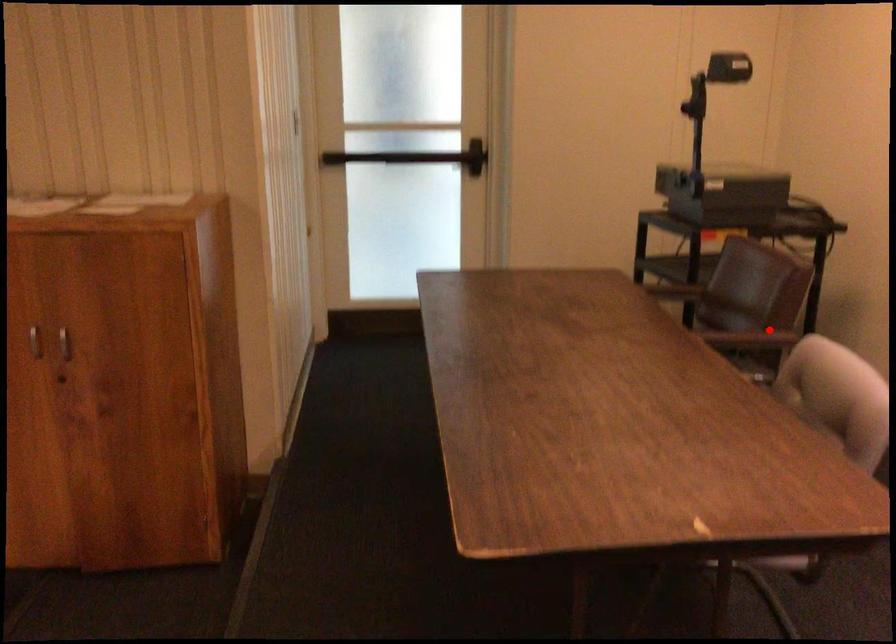
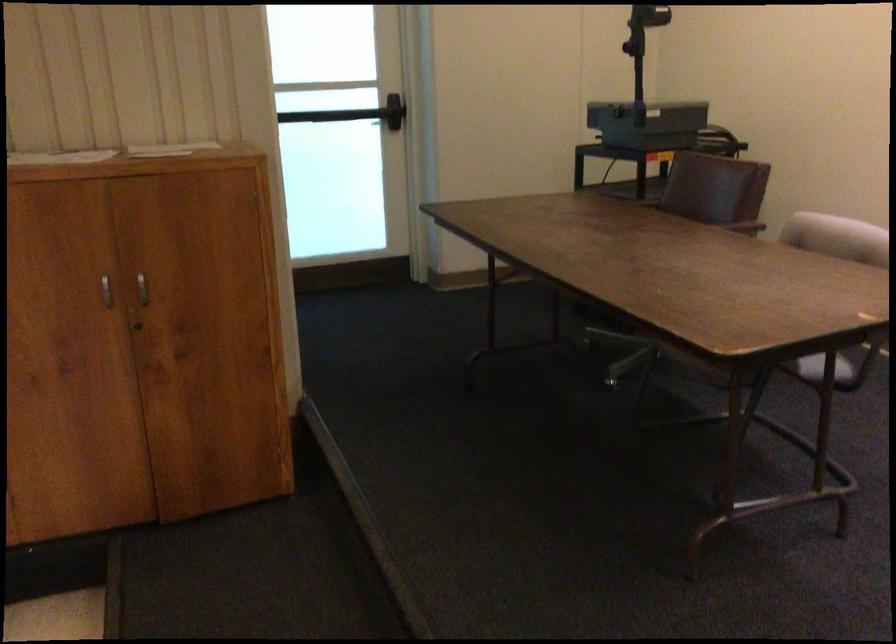
In the second image, find the point that corresponds to the highlighted location in the first image.

(739, 223)